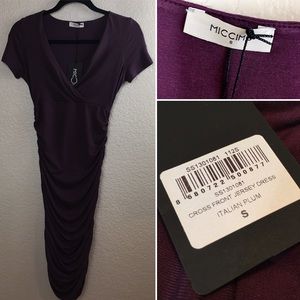
Identify the location of dresser. The width and height of the screenshot is (300, 300). (66, 44).